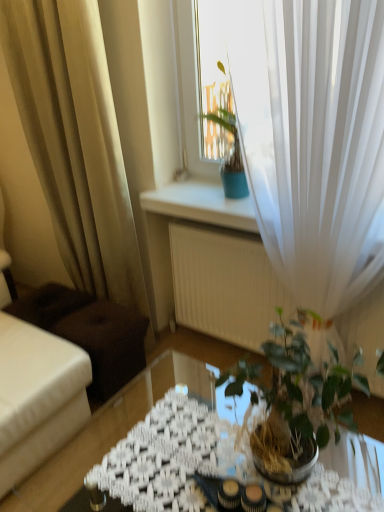
Question: From a real-world perspective, is beige sheer curtain at left, which is counted as the second curtain, starting from the right, positioned above or below green glossy houseplant at center?

Choices:
 (A) above
 (B) below

Answer: (A)

Question: Is beige sheer curtain at left, arranged as the first curtain when viewed from the left, inside or outside of green glossy houseplant at center?

Choices:
 (A) outside
 (B) inside

Answer: (A)

Question: Considering the real-world distances, which object is farthest from the green glossy houseplant at center?

Choices:
 (A) translucent glass table at center
 (B) white sheer curtain at upper right, the 1th curtain positioned from the right
 (C) beige sheer curtain at left, which is counted as the second curtain, starting from the right

Answer: (C)

Question: Estimate the real-world distances between objects in this image. Which object is closer to the green glossy houseplant at center?

Choices:
 (A) white sheer curtain at upper right, the 1th curtain positioned from the right
 (B) translucent glass table at center
 (C) beige sheer curtain at left, which is counted as the second curtain, starting from the right

Answer: (A)